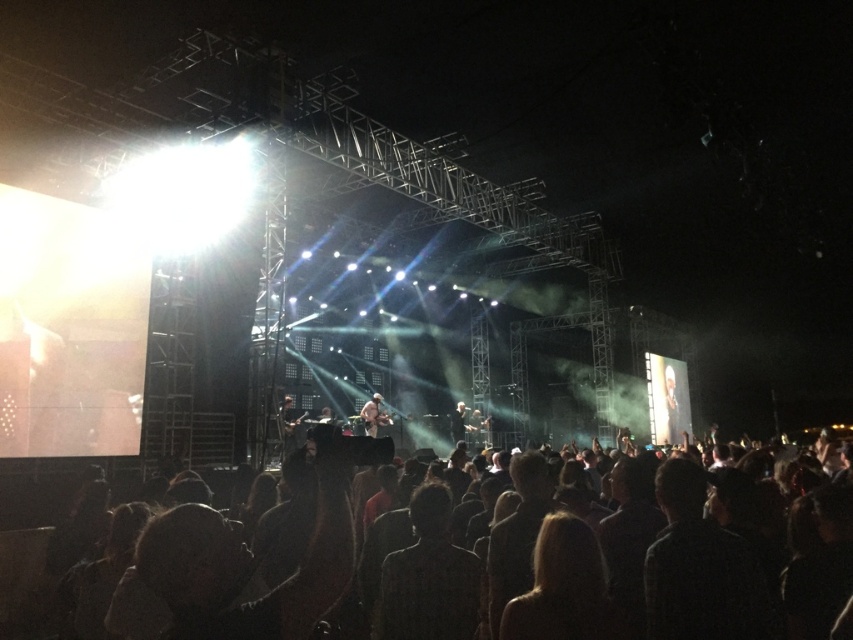
Does dark hair at lower center have a larger size compared to dark fabric head at lower right?

Correct, dark hair at lower center is larger in size than dark fabric head at lower right.

Locate an element on the screen. The height and width of the screenshot is (640, 853). dark hair at lower center is located at coordinates (247, 563).

This screenshot has width=853, height=640. I want to click on dark hair at lower center, so click(247, 563).

How distant is dark fabric at center from light brown leather jacket at center?

dark fabric at center is 25.39 meters away from light brown leather jacket at center.

Who is more forward, (450, 636) or (450, 419)?

Point (450, 636) is more forward.

At what (x,y) coordinates should I click in order to perform the action: click on dark fabric at center. Please return your answer as a coordinate pair (x, y). Looking at the image, I should click on (428, 577).

Identify the location of dark fabric at center. (428, 577).

The width and height of the screenshot is (853, 640). In order to click on blonde hair at center in this screenshot , I will do `click(563, 588)`.

Is point (601, 614) positioned behind point (677, 412)?

That is False.

The width and height of the screenshot is (853, 640). I want to click on blonde hair at center, so click(563, 588).